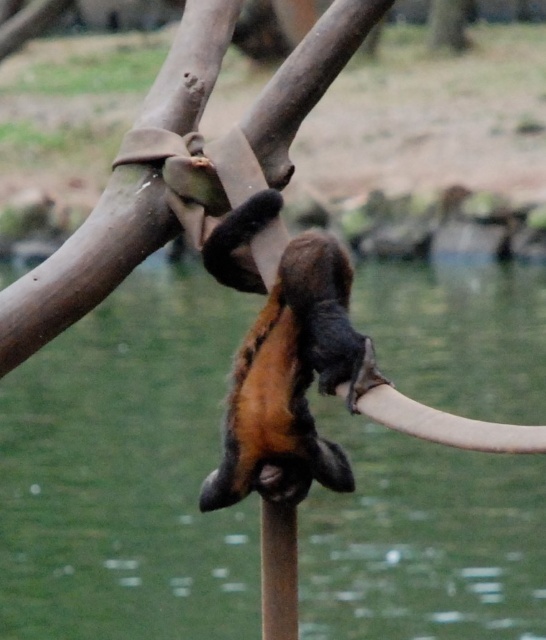
Is brown leather water at center bigger than brown furry monkey at center?

Actually, brown leather water at center might be smaller than brown furry monkey at center.

Between point (85, 372) and point (281, 424), which one is positioned in front?

Positioned in front is point (281, 424).

Identify the location of brown leather water at center. The image size is (546, 640). (127, 472).

Who is positioned more to the left, brown leather water at center or smooth bark tree at upper center?

brown leather water at center

Is brown leather water at center thinner than smooth bark tree at upper center?

Yes, brown leather water at center is thinner than smooth bark tree at upper center.

Who is more distant from viewer, (157,512) or (431,33)?

Point (431,33)

I want to click on brown leather water at center, so click(127, 472).

Does brown furry monkey at center appear on the right side of smooth bark tree at upper center?

In fact, brown furry monkey at center is to the left of smooth bark tree at upper center.

Is brown furry monkey at center wider than smooth bark tree at upper center?

Incorrect, brown furry monkey at center's width does not surpass smooth bark tree at upper center's.

Who is more distant from viewer, [288,312] or [456,4]?

The point [456,4] is behind.

The height and width of the screenshot is (640, 546). I want to click on brown furry monkey at center, so click(x=293, y=381).